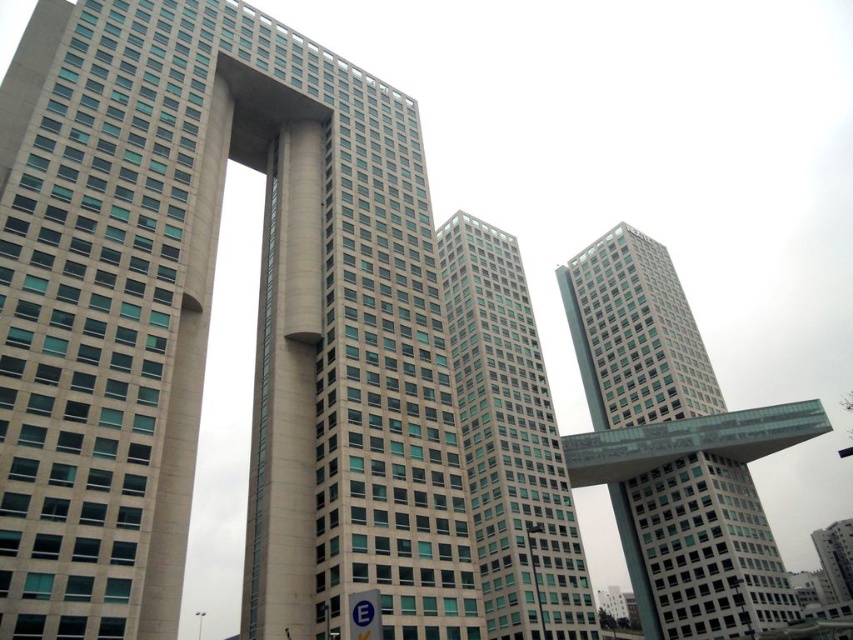
Question: Is beige concrete building at center below glassy teal skyscraper at center?

Choices:
 (A) yes
 (B) no

Answer: (B)

Question: Is beige concrete building at center to the left of white glass tower at center from the viewer's perspective?

Choices:
 (A) no
 (B) yes

Answer: (B)

Question: Is white glass tower at center bigger than glassy teal skyscraper at center?

Choices:
 (A) no
 (B) yes

Answer: (B)

Question: Which object appears closest to the camera in this image?

Choices:
 (A) white glass tower at center
 (B) beige concrete building at center

Answer: (B)

Question: Which point is farther to the camera?

Choices:
 (A) (796, 410)
 (B) (457, 220)
 (C) (192, 72)

Answer: (B)

Question: Which point is farther to the camera?

Choices:
 (A) (619, 278)
 (B) (554, 579)

Answer: (A)